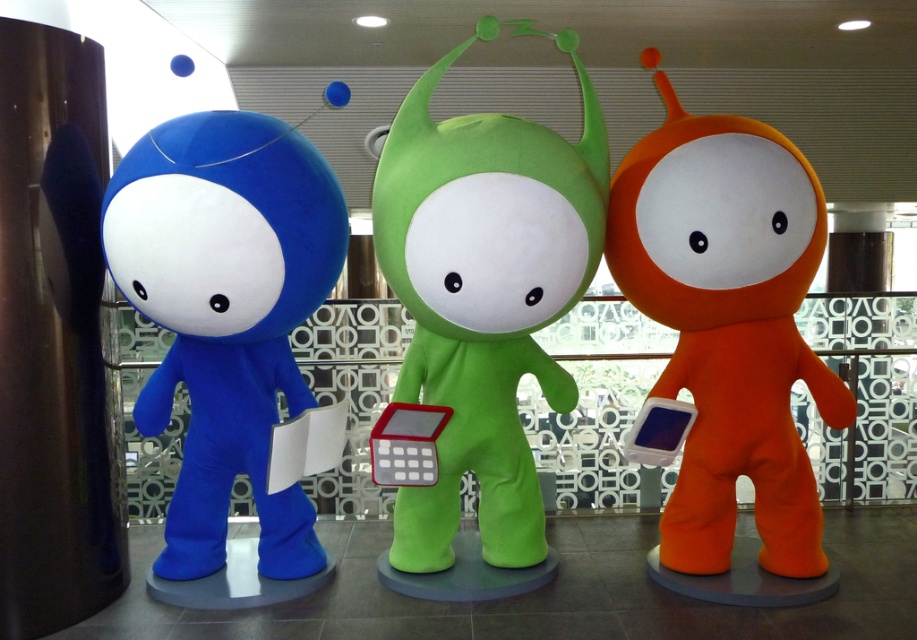
You are a delivery robot with a 50 cm wide package. You need to move between the green plush toy at center and the orange soft plush toy at right. Can you fit through the space between them?

The distance between the green plush toy at center and the orange soft plush toy at right is 66.02 centimeters. Since the package is 50 cm wide, the robot can fit through the space between them as 66.02 cm is wider than 50 cm.

You are a photographer trying to capture a photo of the green plush toy at center and the orange soft plush toy at right. Which one should you focus on first if you want to ensure both are in focus without adjusting your camera settings?

The orange soft plush toy at right is shorter than the green plush toy at center, so focusing on the green plush toy at center first would ensure both are in focus since it is taller and likely further away.

You are standing in the lobby and see the three characters. The blue plush toy at left is at point (x=226, y=314). Can you tell me the coordinates of the blue plush toy at left?

The coordinates of the blue plush toy at left are point (x=226, y=314).